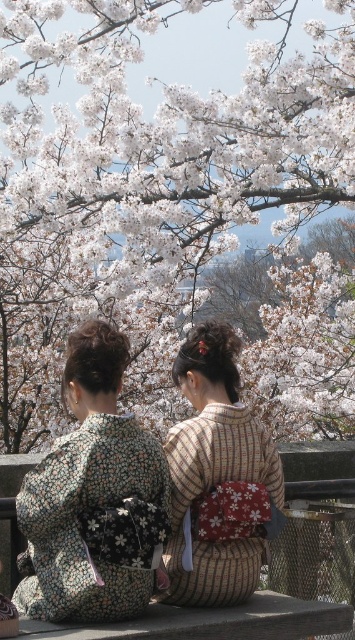
Question: Which point is farther to the camera?

Choices:
 (A) (272, 340)
 (B) (72, 492)
 (C) (242, 515)

Answer: (A)

Question: Is white blossoms at upper center above striped fabric kimono at center?

Choices:
 (A) yes
 (B) no

Answer: (A)

Question: Among these points, which one is farthest from the camera?

Choices:
 (A) 150,576
 (B) 200,497
 (C) 346,58

Answer: (C)

Question: Does white blossoms at upper center appear on the left side of floral kimono at center?

Choices:
 (A) yes
 (B) no

Answer: (B)

Question: Does floral kimono at center have a lesser width compared to striped fabric kimono at center?

Choices:
 (A) yes
 (B) no

Answer: (B)

Question: Estimate the real-world distances between objects in this image. Which object is closer to the white blossoms at upper center?

Choices:
 (A) floral kimono at center
 (B) striped fabric kimono at center

Answer: (B)